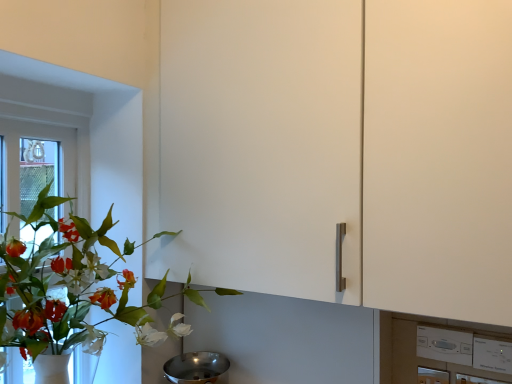
Question: Is polished stainless steel mixing bowl at lower center in front of white plastic switch at lower right?

Choices:
 (A) yes
 (B) no

Answer: (B)

Question: Is polished stainless steel mixing bowl at lower center to the left of white plastic switch at lower right from the viewer's perspective?

Choices:
 (A) yes
 (B) no

Answer: (A)

Question: Considering the relative positions of polished stainless steel mixing bowl at lower center and white plastic switch at lower right in the image provided, is polished stainless steel mixing bowl at lower center behind white plastic switch at lower right?

Choices:
 (A) no
 (B) yes

Answer: (B)

Question: Is polished stainless steel mixing bowl at lower center not near white plastic switch at lower right?

Choices:
 (A) no
 (B) yes

Answer: (A)

Question: Does polished stainless steel mixing bowl at lower center have a greater width compared to white plastic switch at lower right?

Choices:
 (A) yes
 (B) no

Answer: (A)

Question: In terms of height, does polished stainless steel mixing bowl at lower center look taller or shorter compared to green matte plant at left?

Choices:
 (A) short
 (B) tall

Answer: (A)

Question: Considering the positions of point (212, 365) and point (18, 271), is point (212, 365) closer or farther from the camera than point (18, 271)?

Choices:
 (A) closer
 (B) farther

Answer: (B)

Question: From the image's perspective, is polished stainless steel mixing bowl at lower center located above or below green matte plant at left?

Choices:
 (A) above
 (B) below

Answer: (B)

Question: Visually, is polished stainless steel mixing bowl at lower center positioned to the left or to the right of green matte plant at left?

Choices:
 (A) left
 (B) right

Answer: (B)

Question: Relative to white plastic switch at lower right, is green matte plant at left in front or behind?

Choices:
 (A) front
 (B) behind

Answer: (A)

Question: Looking at their shapes, would you say green matte plant at left is wider or thinner than white plastic switch at lower right?

Choices:
 (A) wide
 (B) thin

Answer: (A)

Question: Would you say green matte plant at left is to the left or to the right of white plastic switch at lower right in the picture?

Choices:
 (A) right
 (B) left

Answer: (B)

Question: Considering the positions of point (36, 317) and point (501, 364), is point (36, 317) closer or farther from the camera than point (501, 364)?

Choices:
 (A) farther
 (B) closer

Answer: (B)

Question: Is point (488, 362) positioned closer to the camera than point (11, 205)?

Choices:
 (A) farther
 (B) closer

Answer: (B)

Question: In the image, is white plastic switch at lower right positioned in front of or behind white plastic window frame at left?

Choices:
 (A) front
 (B) behind

Answer: (A)